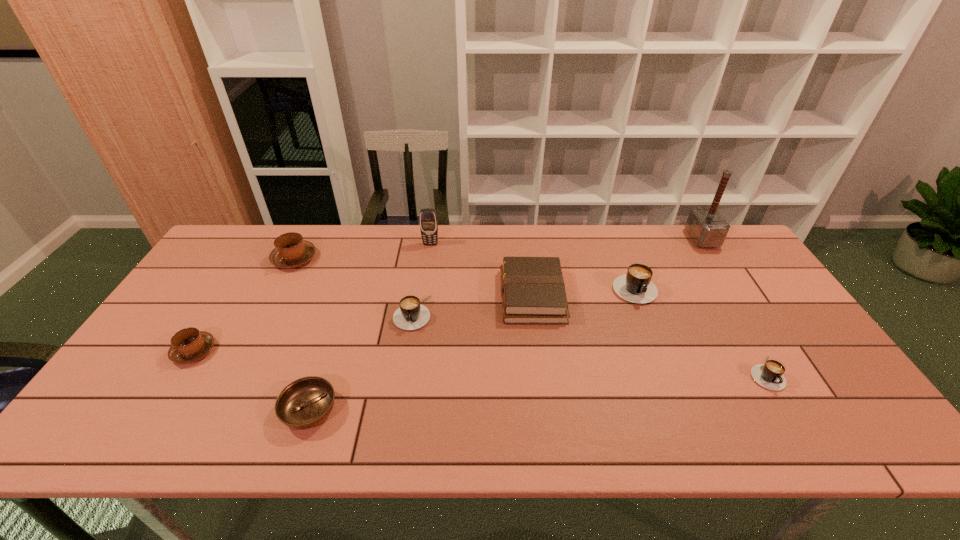
The height and width of the screenshot is (540, 960). What are the coordinates of `the fifth closest cappuccino relative to the hammer` in the screenshot? It's located at (188, 345).

Locate an element on the screen. The height and width of the screenshot is (540, 960). black cappuccino that is the second closest one to the eighth object from right to left is located at coordinates (635, 286).

This screenshot has height=540, width=960. In order to click on the closest black cappuccino relative to the soup bowl in this screenshot , I will do `click(411, 315)`.

At what (x,y) coordinates should I click in order to perform the action: click on vacant space that satisfies the following two spatial constraints: 1. on the side of the seventh object from right to left with the handle; 2. on the right side of the leftmost object. Please return your answer as a coordinate pair (x, y). This screenshot has width=960, height=540. Looking at the image, I should click on (156, 410).

The width and height of the screenshot is (960, 540). I want to click on vacant space that satisfies the following two spatial constraints: 1. on the spine side of the sixth object from left to right; 2. with the handle on the side of the leftmost black cappuccino, so click(535, 313).

At what (x,y) coordinates should I click in order to perform the action: click on free location that satisfies the following two spatial constraints: 1. on the spine side of the fourth object from right to left; 2. on the side of the leftmost object with the handle. Please return your answer as a coordinate pair (x, y). This screenshot has width=960, height=540. Looking at the image, I should click on (540, 351).

Identify the location of free space that satisfies the following two spatial constraints: 1. on the spine side of the Bible; 2. with the handle on the side of the leftmost black cappuccino. The width and height of the screenshot is (960, 540). (535, 313).

Find the location of a particular element. The width and height of the screenshot is (960, 540). free spot that satisfies the following two spatial constraints: 1. on the side of the bigger brown cappuccino with the handle; 2. on the left side of the third object from left to right is located at coordinates (217, 410).

Find the location of a particular element. Image resolution: width=960 pixels, height=540 pixels. blank space that satisfies the following two spatial constraints: 1. on the spine side of the Bible; 2. with the handle on the side of the third cappuccino from right to left is located at coordinates (535, 313).